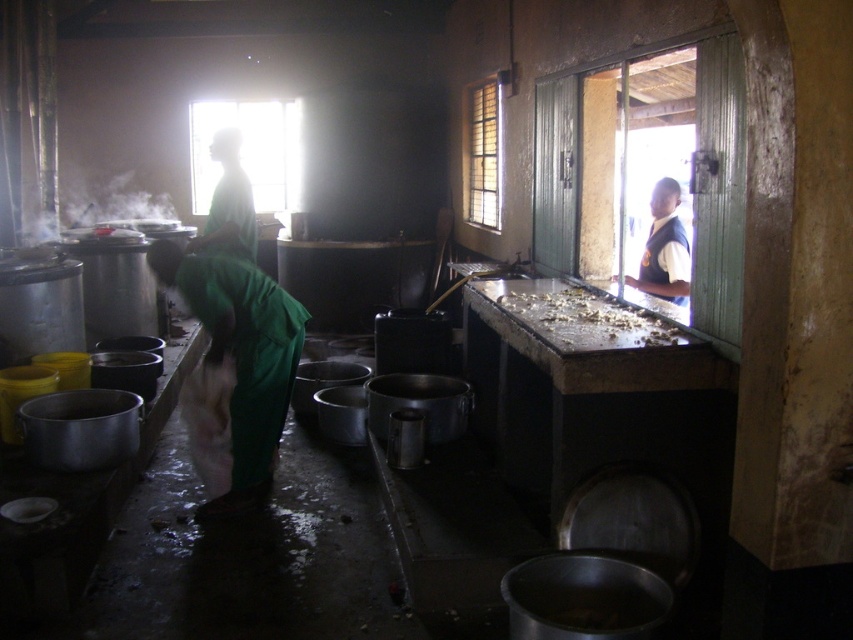
Question: Among these points, which one is nearest to the camera?

Choices:
 (A) (225, 168)
 (B) (250, 310)

Answer: (B)

Question: Which of these objects is positioned closest to the green fabric apron at lower left?

Choices:
 (A) shiny metallic surface at right
 (B) white shirt at upper right
 (C) green fabric at center

Answer: (C)

Question: Can you confirm if green fabric apron at lower left is positioned above white shirt at upper right?

Choices:
 (A) yes
 (B) no

Answer: (B)

Question: Is green fabric apron at lower left to the left of shiny metallic surface at right from the viewer's perspective?

Choices:
 (A) yes
 (B) no

Answer: (A)

Question: Does green fabric at center appear on the left side of white shirt at upper right?

Choices:
 (A) no
 (B) yes

Answer: (B)

Question: Which object is farther from the camera taking this photo?

Choices:
 (A) white shirt at upper right
 (B) shiny metallic surface at right
 (C) green fabric at center

Answer: (A)